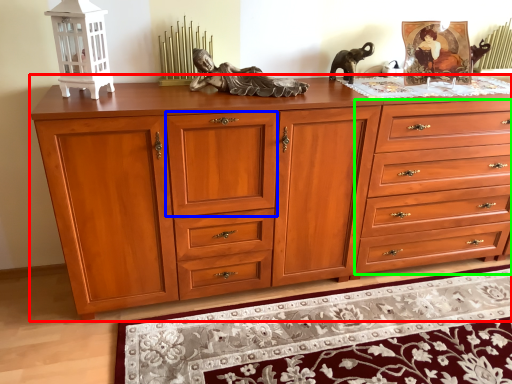
Question: Estimate the real-world distances between objects in this image. Which object is closer to chest of drawers (highlighted by a red box), drawer (highlighted by a blue box) or drawer (highlighted by a green box)?

Choices:
 (A) drawer
 (B) drawer

Answer: (A)